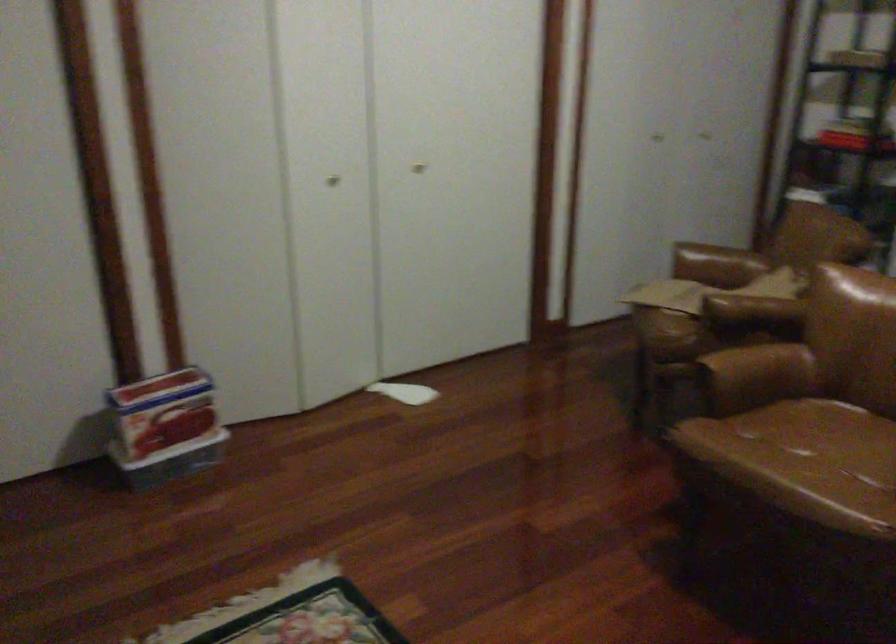
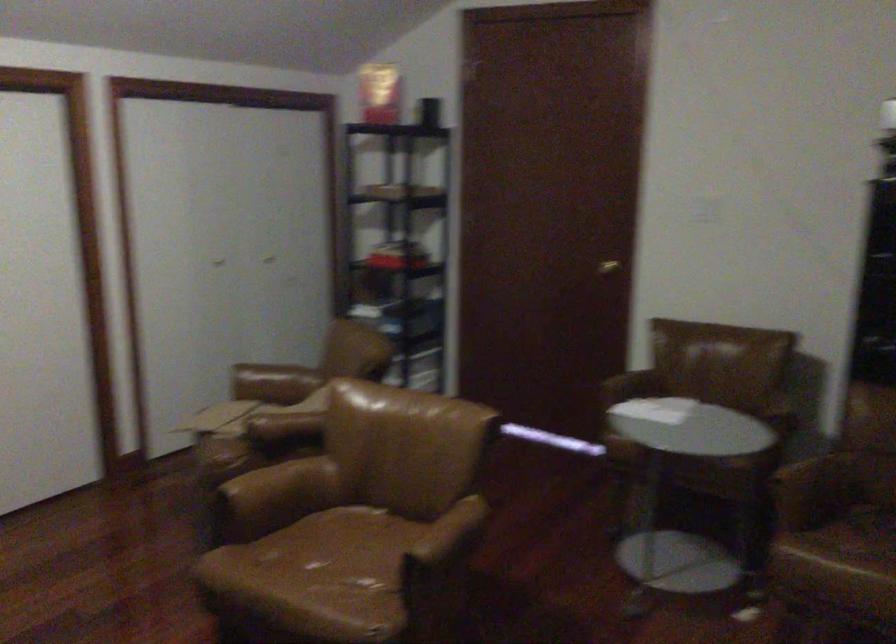
Find the pixel in the second image that matches point 745,362 in the first image.

(280, 484)